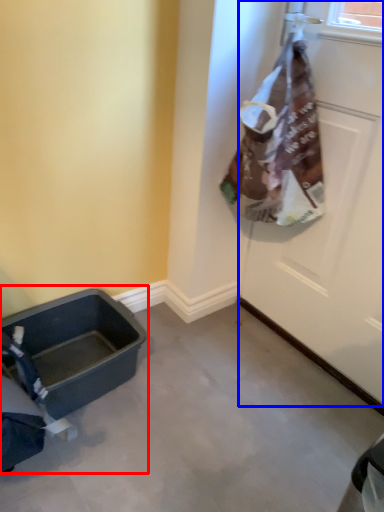
Question: Which point is closer to the camera, baby carriage (highlighted by a red box) or door (highlighted by a blue box)?

Choices:
 (A) baby carriage
 (B) door

Answer: (B)